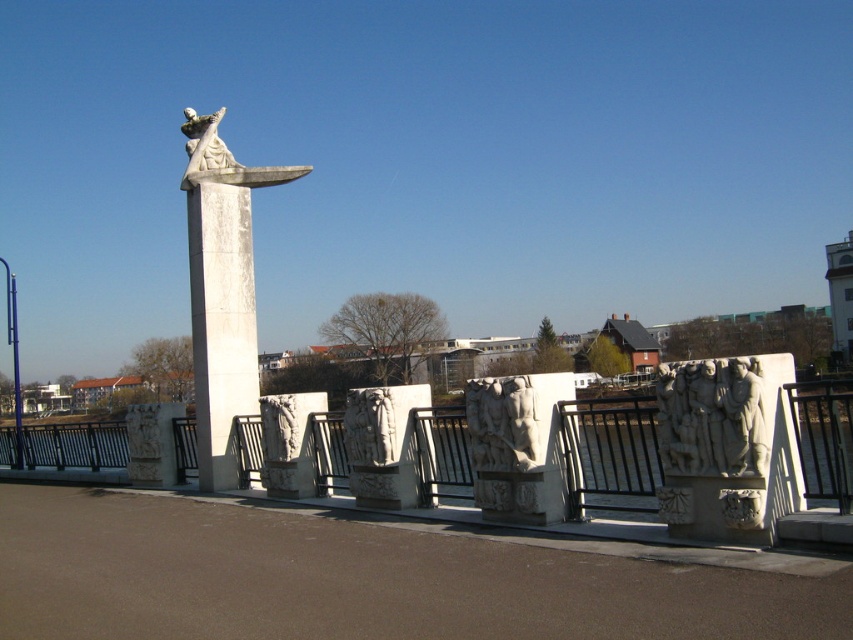
Is white stone fence at center positioned before white stone column at center?

Yes, white stone fence at center is closer to the viewer.

Locate an element on the screen. white stone fence at center is located at coordinates (608, 454).

Is white stone carving at right bigger than white stone statue at upper center?

Incorrect, white stone carving at right is not larger than white stone statue at upper center.

Does white stone carving at right appear over white stone statue at upper center?

No, white stone carving at right is not above white stone statue at upper center.

Locate an element on the screen. white stone carving at right is located at coordinates (712, 417).

Find the location of `white stone carving at right`. white stone carving at right is located at coordinates click(712, 417).

Find the location of a particular element. The height and width of the screenshot is (640, 853). white stone statue at center is located at coordinates (221, 291).

Is the position of white stone statue at center less distant than that of white stone carving at right?

No, it is behind white stone carving at right.

Is point (231, 400) closer to camera compared to point (659, 394)?

No, (231, 400) is behind (659, 394).

Image resolution: width=853 pixels, height=640 pixels. In order to click on white stone statue at center in this screenshot , I will do `click(221, 291)`.